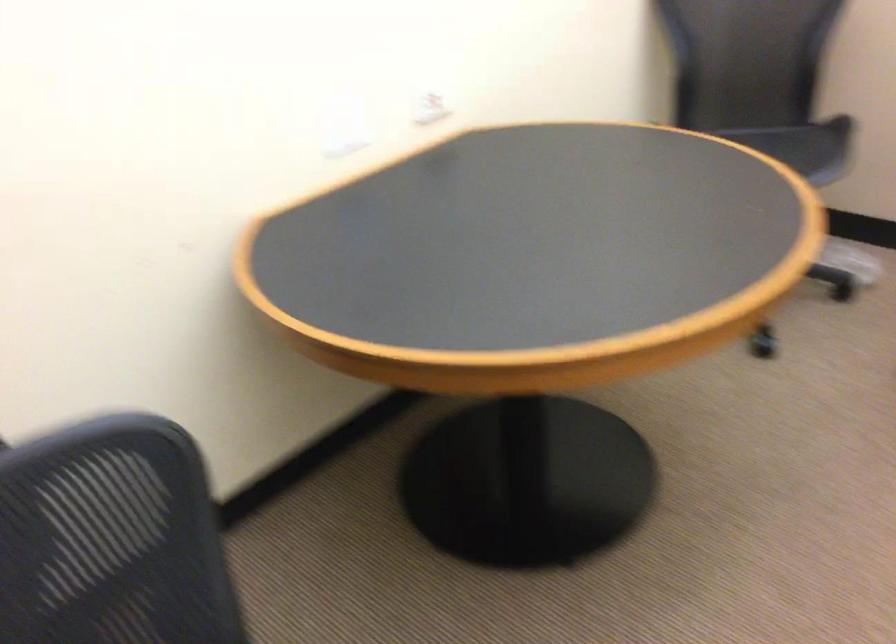
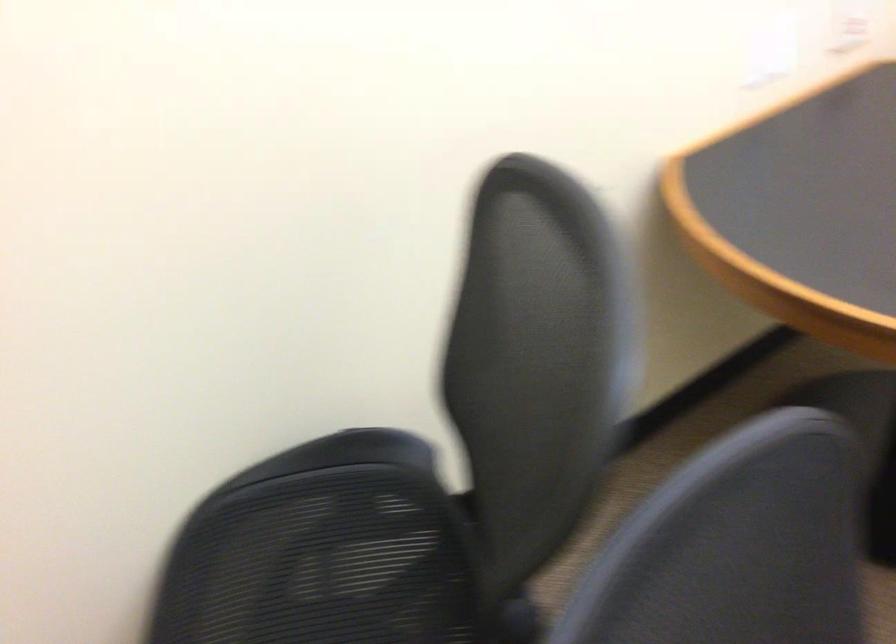
Question: The first image is from the beginning of the video and the second image is from the end. How did the camera likely rotate when shooting the video?

Choices:
 (A) Left
 (B) Right
 (C) Up
 (D) Down

Answer: (A)